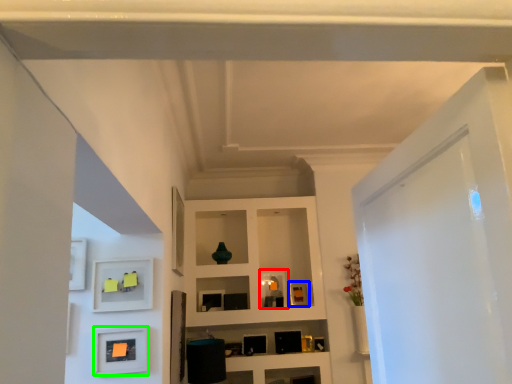
Question: Based on their relative distances, which object is farther from picture frame (highlighted by a red box)? Choose from picture frame (highlighted by a blue box) and picture frame (highlighted by a green box).

Choices:
 (A) picture frame
 (B) picture frame

Answer: (B)